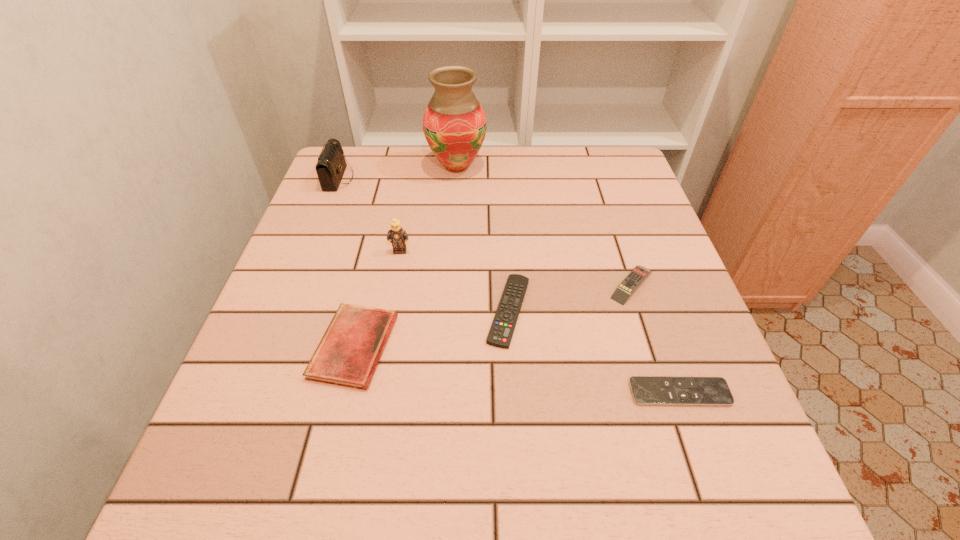
Where is `vacant space located 0.340m in front of the Lego`? vacant space located 0.340m in front of the Lego is located at coordinates (374, 391).

I want to click on free space located on the front flap of the leftmost object, so click(x=438, y=178).

Identify the location of free point located on the front of the tallest remote control. Image resolution: width=960 pixels, height=540 pixels. (705, 505).

Where is `free space located 0.290m on the back of the diary`? Image resolution: width=960 pixels, height=540 pixels. free space located 0.290m on the back of the diary is located at coordinates pyautogui.click(x=385, y=217).

Locate an element on the screen. vacant region located 0.210m on the right of the second shortest object is located at coordinates (638, 310).

Identify the location of vacant space situated on the back of the shortest object. (645, 293).

The width and height of the screenshot is (960, 540). Identify the location of vase that is positioned at the far edge. (454, 124).

Locate an element on the screen. This screenshot has width=960, height=540. clutch bag that is positioned at the far edge is located at coordinates (331, 165).

I want to click on clutch bag that is at the left edge, so click(331, 165).

I want to click on diary at the left edge, so tap(348, 354).